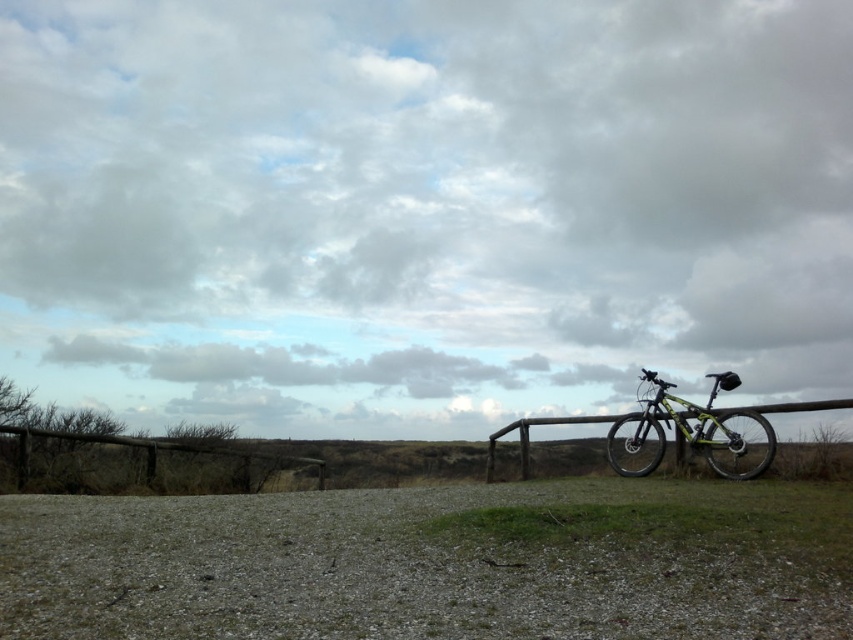
Question: Can you confirm if gravelly dirt field at lower center is positioned below yellow-green matte bicycle at right?

Choices:
 (A) no
 (B) yes

Answer: (B)

Question: Which point is farther to the camera?

Choices:
 (A) coord(840,595)
 (B) coord(648,381)

Answer: (B)

Question: Is gravelly dirt field at lower center closer to the viewer compared to yellow-green matte bicycle at right?

Choices:
 (A) yes
 (B) no

Answer: (A)

Question: Can you confirm if gravelly dirt field at lower center is positioned to the left of yellow-green matte bicycle at right?

Choices:
 (A) no
 (B) yes

Answer: (B)